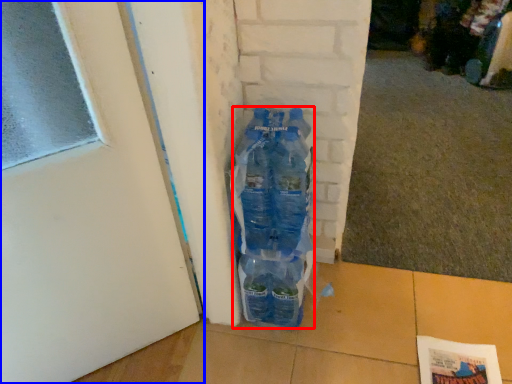
Question: Which object is further to the camera taking this photo, bottle (highlighted by a red box) or door (highlighted by a blue box)?

Choices:
 (A) bottle
 (B) door

Answer: (A)